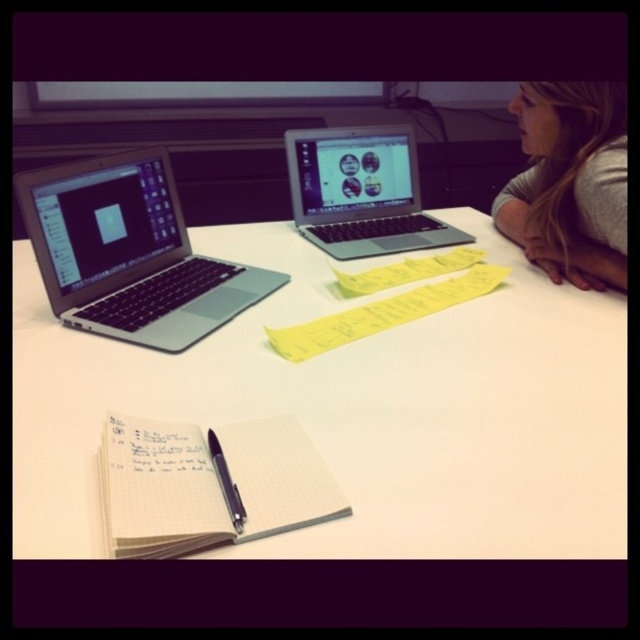
Between gray fabric hair at upper right and silver metallic laptop at center, which one has less height?

With less height is silver metallic laptop at center.

Is point (580, 227) positioned behind point (378, 230)?

That is False.

Is point (573, 273) in front of point (381, 182)?

Yes, it is.

Where is `gray fabric hair at upper right`? gray fabric hair at upper right is located at coordinates click(x=570, y=182).

Is point (173, 522) less distant than point (541, 237)?

Yes, point (173, 522) is in front of point (541, 237).

Can you confirm if white paper notebook at lower center is positioned above gray fabric hair at upper right?

Incorrect, white paper notebook at lower center is not positioned above gray fabric hair at upper right.

Is point (198, 541) farther from viewer compared to point (545, 252)?

That is False.

Identify the location of white paper notebook at lower center. (209, 484).

Can you confirm if silver metallic laptop at left is bigger than yellow paper at center?

Yes.

Who is more forward, (88,307) or (346,340)?

Point (346,340) is more forward.

This screenshot has height=640, width=640. In order to click on silver metallic laptop at left in this screenshot , I will do `click(129, 252)`.